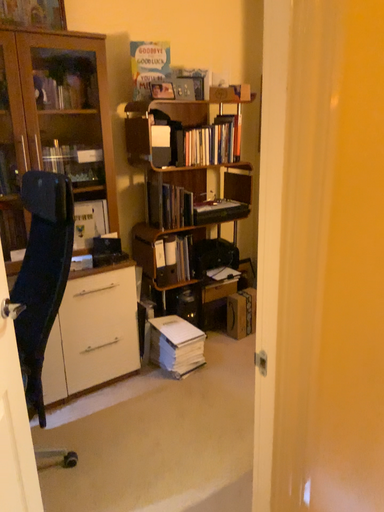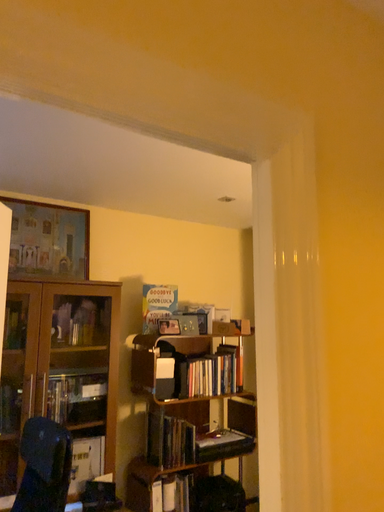
Question: How did the camera likely rotate when shooting the video?

Choices:
 (A) rotated downward
 (B) rotated upward

Answer: (B)